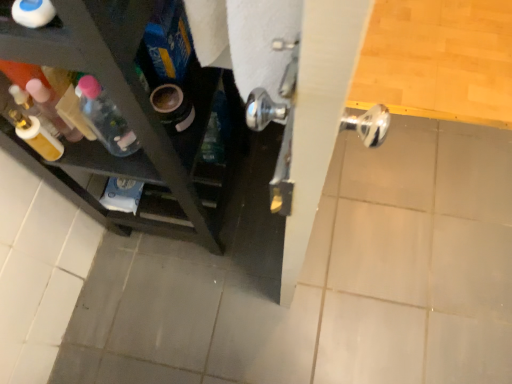
Question: Is translucent plastic bottle at left, which is the 3th bottle in front-to-back order, to the left or to the right of translucent plastic bottle at left, the 2th bottle when ordered from back to front, in the image?

Choices:
 (A) right
 (B) left

Answer: (A)

Question: Is translucent plastic bottle at left, which is the first bottle from back to front, taller or shorter than translucent plastic bottle at left, arranged as the 1th bottle when viewed from the left?

Choices:
 (A) tall
 (B) short

Answer: (B)

Question: Which of these objects is positioned farthest from the white glossy bottle at upper left, acting as the first bottle starting from the front?

Choices:
 (A) translucent plastic bottle at left, the 3th bottle viewed from the right
 (B) translucent plastic bottle at left, which ranks as the 2th bottle in left-to-right order

Answer: (A)

Question: Estimate the real-world distances between objects in this image. Which object is farther from the white glossy bottle at upper left, placed as the third bottle when sorted from left to right?

Choices:
 (A) translucent plastic bottle at left, which is the first bottle from back to front
 (B) translucent plastic bottle at left, the 3th bottle viewed from the right

Answer: (B)